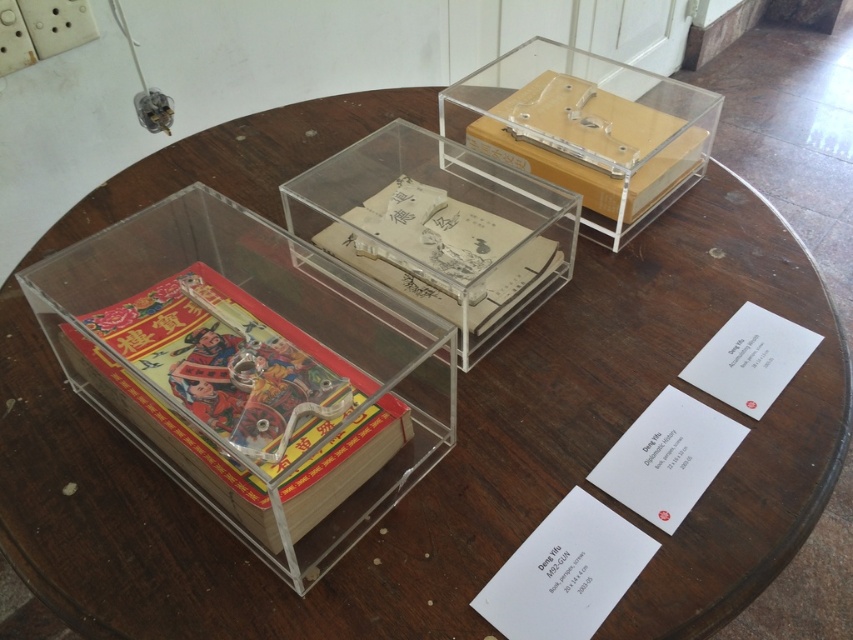
In the scene shown: Is transparent acrylic box at upper center further to camera compared to yellowish paper book at center?

Yes, it is behind yellowish paper book at center.

Who is positioned more to the right, transparent acrylic box at upper center or yellowish paper book at center?

transparent acrylic box at upper center is more to the right.

Which is behind, point (572, 102) or point (426, 264)?

Positioned behind is point (572, 102).

The height and width of the screenshot is (640, 853). I want to click on transparent acrylic box at upper center, so click(x=585, y=129).

Find the location of a particular element. red glossy book at center is located at coordinates (239, 397).

Does red glossy book at center have a greater height compared to transparent acrylic box at upper center?

In fact, red glossy book at center may be shorter than transparent acrylic box at upper center.

Does point (270, 417) come farther from viewer compared to point (525, 124)?

No, it is not.

The height and width of the screenshot is (640, 853). What are the coordinates of `red glossy book at center` in the screenshot? It's located at tap(239, 397).

Who is lower down, red glossy book at center or yellowish paper book at center?

red glossy book at center

Is point (305, 468) closer to camera compared to point (479, 307)?

Yes, it is in front of point (479, 307).

This screenshot has width=853, height=640. Identify the location of red glossy book at center. (239, 397).